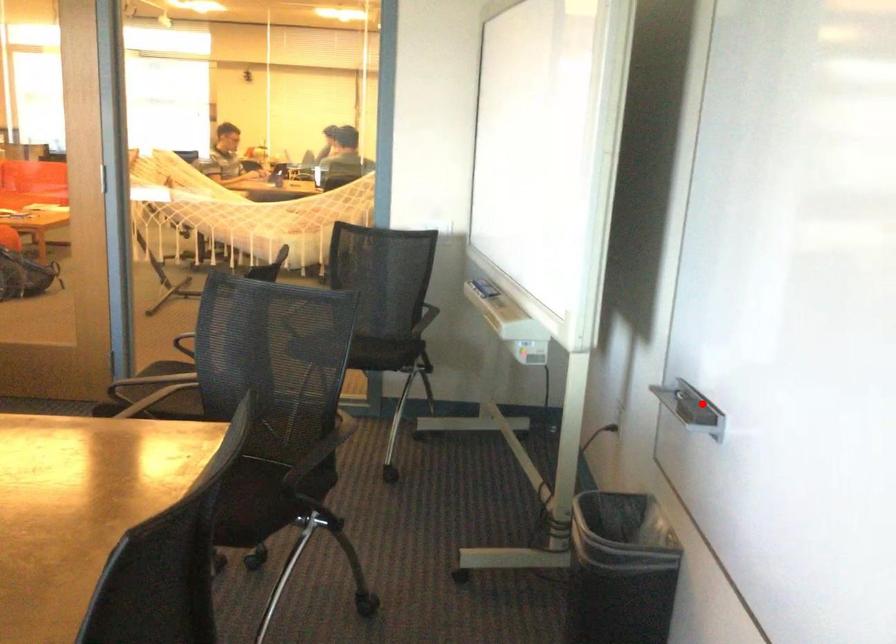
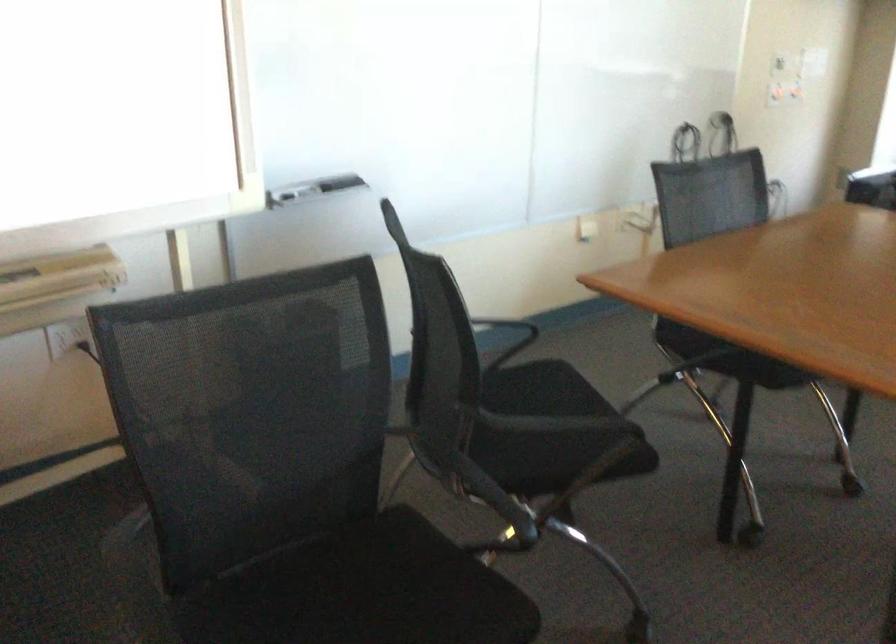
Question: I am providing you with two images of the same scene from different viewpoints. Given a red point in image1, look at the same physical point in image2. Is it:

Choices:
 (A) Closer to the viewpoint
 (B) Farther from the viewpoint

Answer: (B)